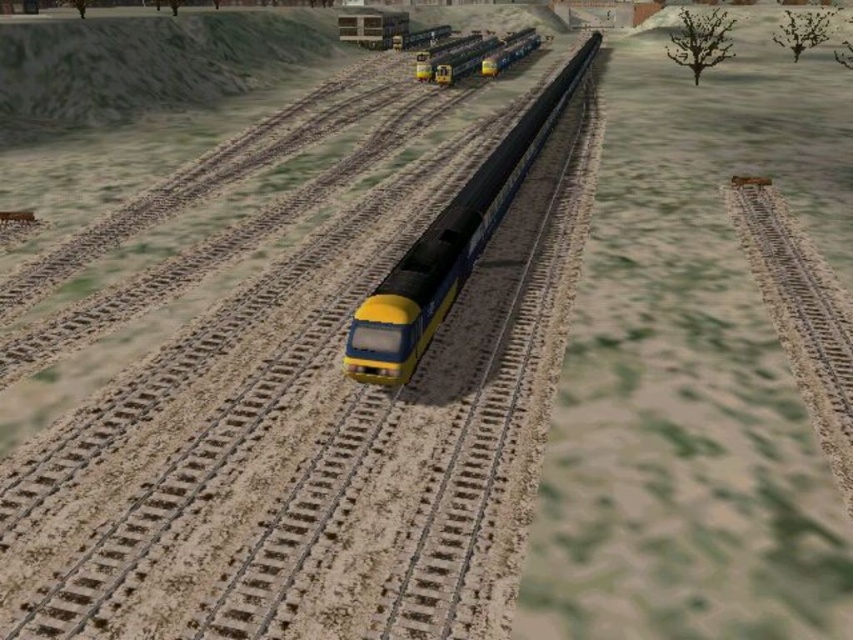
Which of these two, yellow matte train at center or yellow matte train at upper center, stands shorter?

With less height is yellow matte train at upper center.

Between point (498, 163) and point (485, 51), which one is positioned in front?

Point (498, 163) is more forward.

Locate an element on the screen. This screenshot has height=640, width=853. yellow matte train at center is located at coordinates (451, 244).

Where is `yellow matte train at center`? The width and height of the screenshot is (853, 640). yellow matte train at center is located at coordinates (451, 244).

Which is behind, point (317, 451) or point (421, 268)?

The point (421, 268) is behind.

Can you confirm if yellow matte train track at center is bigger than yellow matte train at center?

Incorrect, yellow matte train track at center is not larger than yellow matte train at center.

Locate an element on the screen. yellow matte train track at center is located at coordinates [x=294, y=396].

The image size is (853, 640). I want to click on yellow matte train track at center, so click(x=294, y=396).

Which is above, yellow matte train track at center or yellow matte train at upper center?

yellow matte train at upper center is higher up.

Between point (207, 470) and point (529, 35), which one is positioned behind?

Positioned behind is point (529, 35).

Between point (363, 563) and point (467, 65), which one is positioned behind?

The point (467, 65) is more distant.

Where is `yellow matte train track at center`? This screenshot has height=640, width=853. yellow matte train track at center is located at coordinates (294, 396).